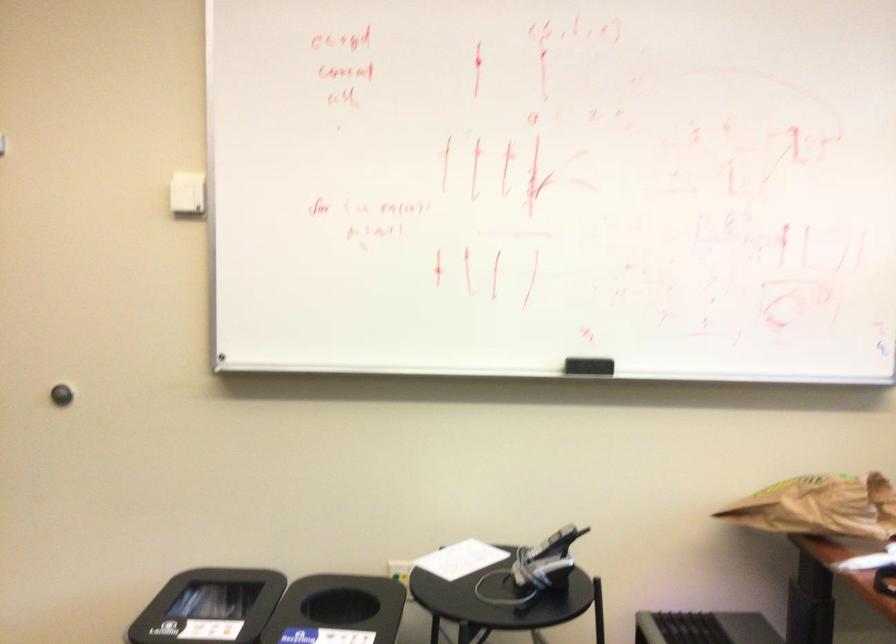
The location [552,544] corresponds to which object?

It corresponds to the phone handset in the image.